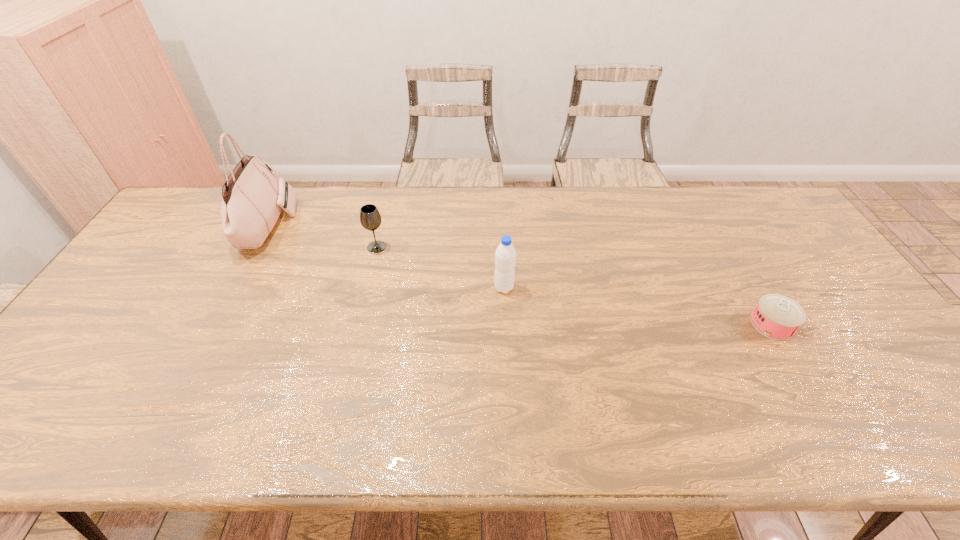
Identify the location of the tallest object. This screenshot has width=960, height=540. (252, 197).

The width and height of the screenshot is (960, 540). What are the coordinates of `the leftmost object` in the screenshot? It's located at (252, 197).

The image size is (960, 540). Identify the location of water bottle. (505, 256).

This screenshot has width=960, height=540. In order to click on the second nearest object in this screenshot , I will do `click(505, 256)`.

Where is `wineglass`? This screenshot has width=960, height=540. wineglass is located at coordinates (370, 218).

Identify the location of the third object from right to left. Image resolution: width=960 pixels, height=540 pixels. (370, 218).

At what (x,y) coordinates should I click in order to perform the action: click on the rightmost object. Please return your answer as a coordinate pair (x, y). Image resolution: width=960 pixels, height=540 pixels. Looking at the image, I should click on (778, 317).

Image resolution: width=960 pixels, height=540 pixels. Identify the location of the nearest object. (778, 317).

Where is `free space located on the side of the handbag with the attached pouch`? The width and height of the screenshot is (960, 540). free space located on the side of the handbag with the attached pouch is located at coordinates (398, 226).

Image resolution: width=960 pixels, height=540 pixels. Find the location of `vacant region located 0.250m on the front of the third farthest object`. vacant region located 0.250m on the front of the third farthest object is located at coordinates (508, 373).